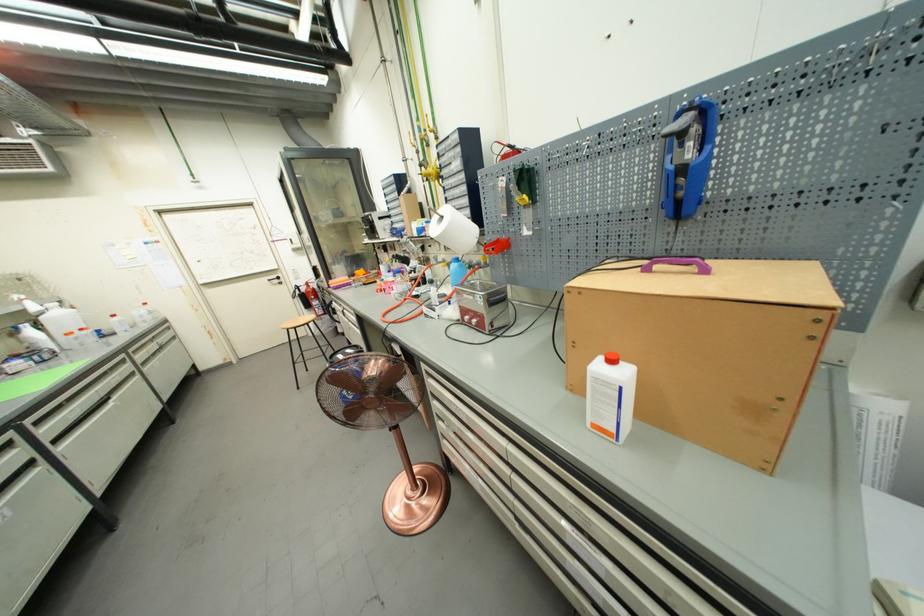
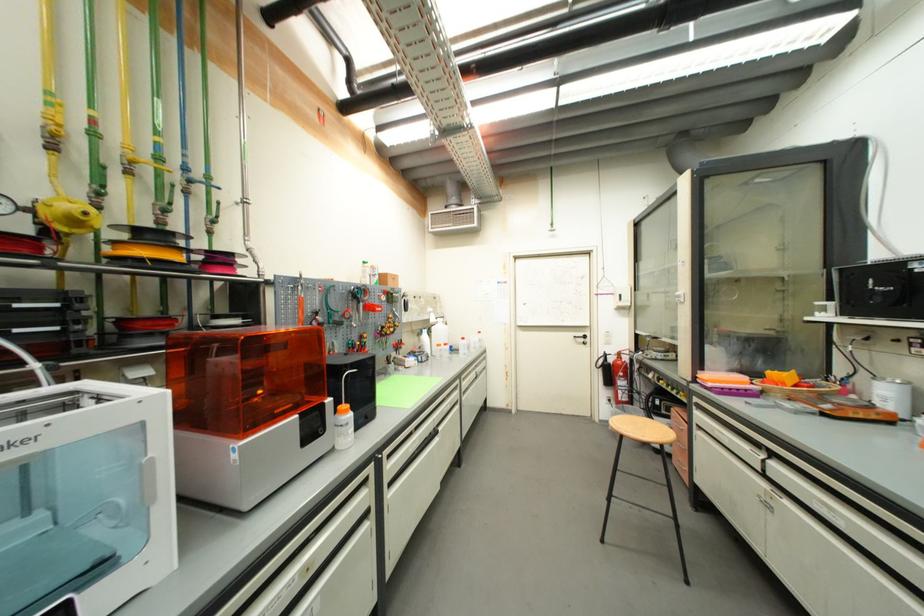
Where in the second image is the point corresponding to the point at 318,299 from the first image?

(626, 376)